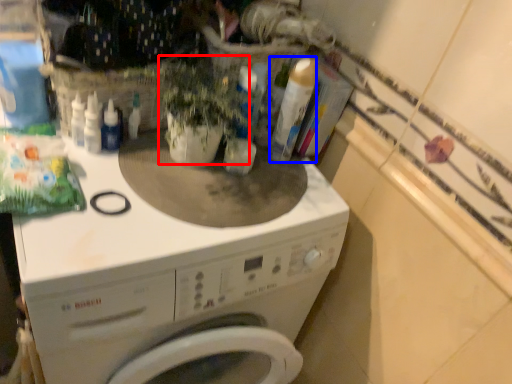
Question: Which object appears farthest to the camera in this image, plant (highlighted by a red box) or cleaning product (highlighted by a blue box)?

Choices:
 (A) plant
 (B) cleaning product

Answer: (B)